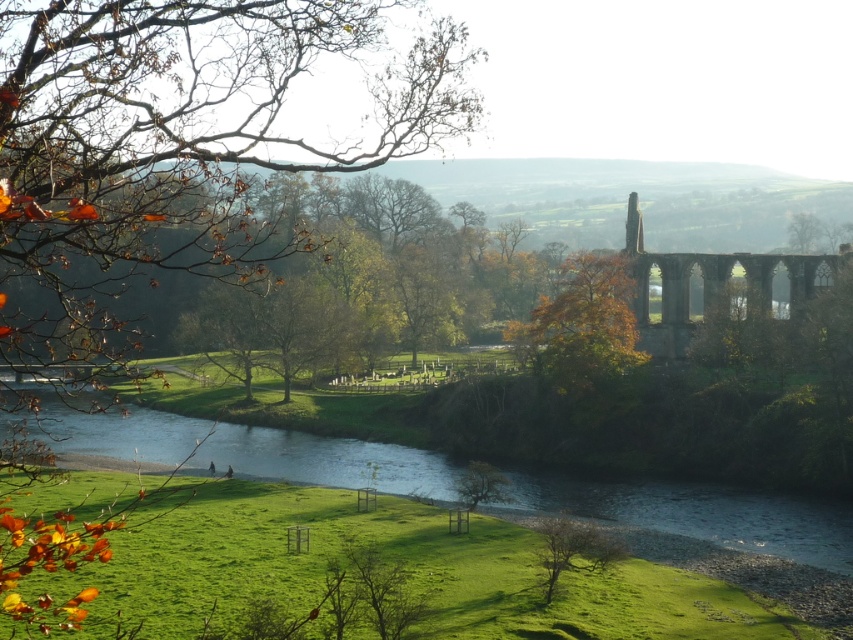
You are standing in the rural landscape scene and want to take a photo of the stone structure on the far bank. The brown leafy branch at upper left is blocking your view. Can you move to the right to avoid the branch?

The brown leafy branch at upper left is located at point (175, 148), so moving to the right might help avoid the branch blocking the view of the stone structure on the far bank.

What are the coordinates of the green grassy river at lower center in the image?

The green grassy river at lower center is located at coordinates point (699, 513).